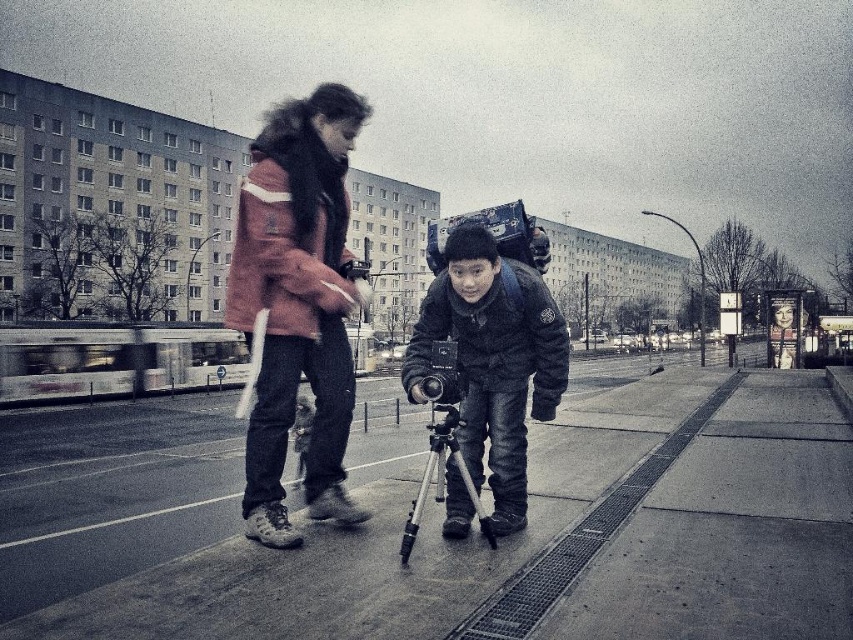
You are a photographer standing on the sidewalk. You see the matte pink jacket at center and the matte black camera at center. Which object is positioned higher from the ground?

The matte pink jacket at center is above the matte black camera at center, so the matte pink jacket at center is higher from the ground.